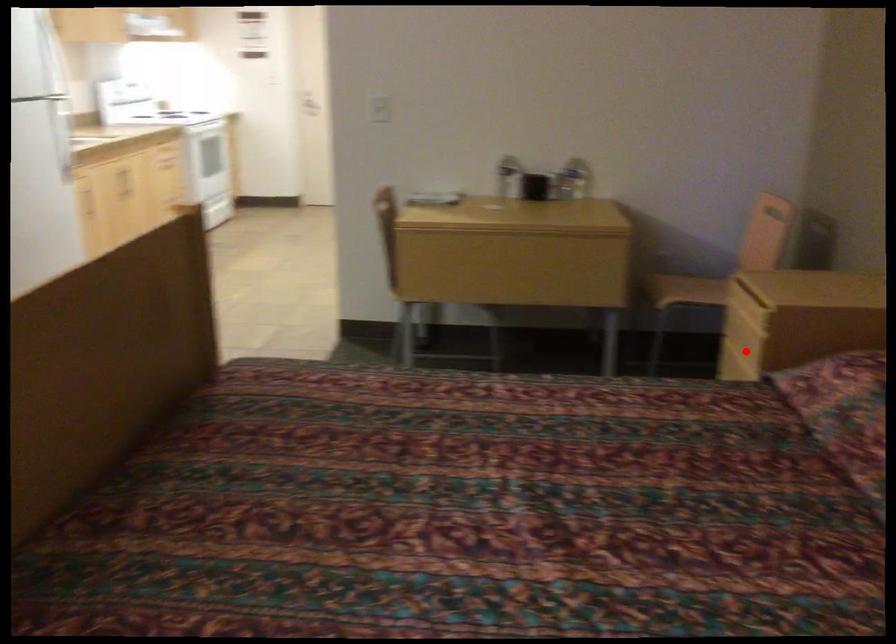
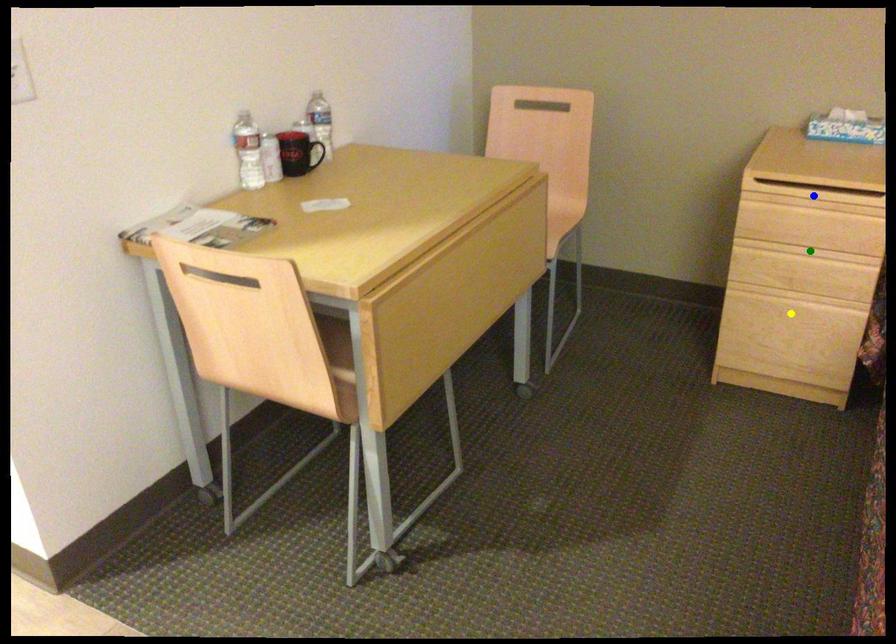
Question: I am providing you with two images of the same scene from different viewpoints. A red point is marked on the first image. You are given multiple points on the second image. Which mark in image 2 goes with the point in image 1?

Choices:
 (A) blue point
 (B) yellow point
 (C) green point

Answer: (C)